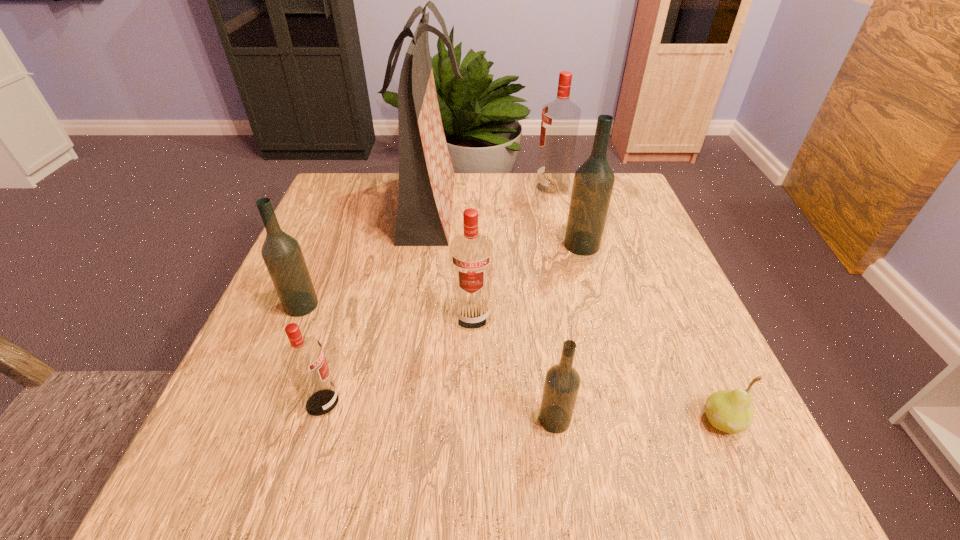
Locate an element on the screen. The width and height of the screenshot is (960, 540). free space between the second red vodka from left to right and the farthest red vodka is located at coordinates (513, 252).

I want to click on blank region between the shopping bag and the leftmost black vodka, so click(366, 256).

This screenshot has height=540, width=960. I want to click on free spot between the shopping bag and the smallest red vodka, so click(376, 305).

Find the location of `free space that is in between the shopping bag and the second black vodka from left to right`. free space that is in between the shopping bag and the second black vodka from left to right is located at coordinates (492, 313).

Image resolution: width=960 pixels, height=540 pixels. What are the coordinates of `the second closest object to the rightmost black vodka` in the screenshot? It's located at (471, 254).

The width and height of the screenshot is (960, 540). I want to click on the third closest object to the second black vodka from left to right, so click(303, 358).

Point out which vodka is positioned as the third nearest to the leftmost red vodka. Please provide its 2D coordinates. Your answer should be formatted as a tuple, i.e. [(x, y)], where the tuple contains the x and y coordinates of a point satisfying the conditions above.

[(562, 382)]

The image size is (960, 540). Find the location of `vodka that is the fourth closest to the leftmost vodka`. vodka that is the fourth closest to the leftmost vodka is located at coordinates (593, 183).

I want to click on red vodka that stands as the closest to the smallest red vodka, so click(471, 254).

I want to click on the closest red vodka to the farthest black vodka, so click(560, 119).